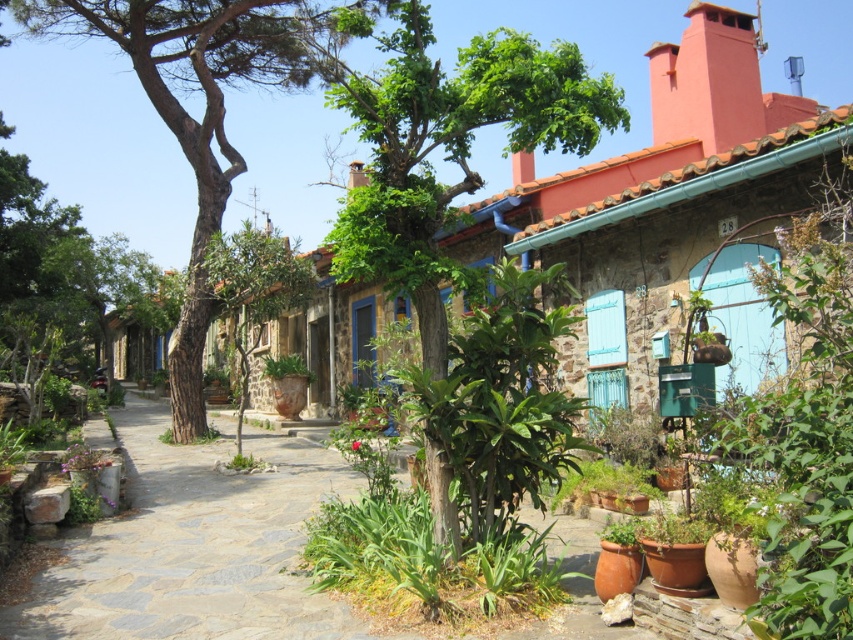
Question: Can you confirm if gray stone path at center is thinner than smooth terracotta chimney at upper right?

Choices:
 (A) yes
 (B) no

Answer: (B)

Question: Estimate the real-world distances between objects in this image. Which object is closer to the smooth terracotta chimney at upper right?

Choices:
 (A) gray stone path at center
 (B) green leafy tree at center

Answer: (B)

Question: Can you confirm if gray stone path at center is wider than smooth terracotta chimney at upper right?

Choices:
 (A) no
 (B) yes

Answer: (B)

Question: Is brown rough bark tree at center in front of smooth terracotta chimney at upper right?

Choices:
 (A) yes
 (B) no

Answer: (A)

Question: Which object appears farthest from the camera in this image?

Choices:
 (A) green leafy tree at center
 (B) brown rough bark tree at center
 (C) gray stone path at center
 (D) smooth terracotta chimney at upper right

Answer: (D)

Question: Which of the following is the closest to the observer?

Choices:
 (A) green leafy tree at center
 (B) smooth terracotta chimney at upper right

Answer: (A)